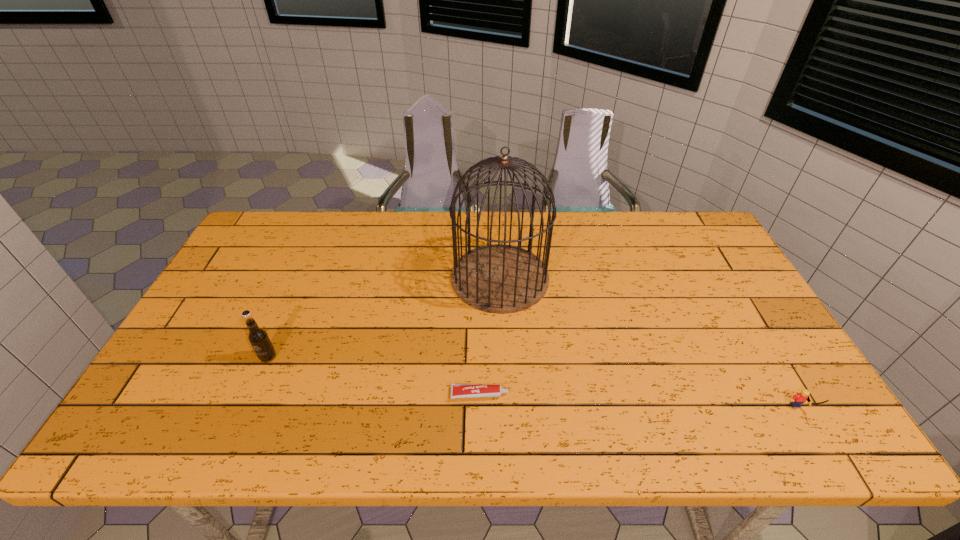
You are a GUI agent. You are given a task and a screenshot of the screen. Output one action in this format:
    pyautogui.click(x=<x>, y=<y>)
    Task: Click on the vacant space that is in between the shortest object and the third tallest object
    
    Given the screenshot: What is the action you would take?
    pyautogui.click(x=639, y=403)

Locate an element on the screen. This screenshot has height=540, width=960. unoccupied position between the leftmost object and the farthest object is located at coordinates (384, 318).

Identify the location of free space between the second tallest object and the rightmost object. The height and width of the screenshot is (540, 960). (534, 384).

Locate an element on the screen. This screenshot has width=960, height=540. object that is the second closest to the shortest object is located at coordinates [x=257, y=336].

Identify the location of the second closest object to the birdcage. (257, 336).

Where is `free location that satisfies the following two spatial constraints: 1. at the door of the birdcage; 2. on the label of the leftmost object`? The image size is (960, 540). free location that satisfies the following two spatial constraints: 1. at the door of the birdcage; 2. on the label of the leftmost object is located at coordinates (504, 357).